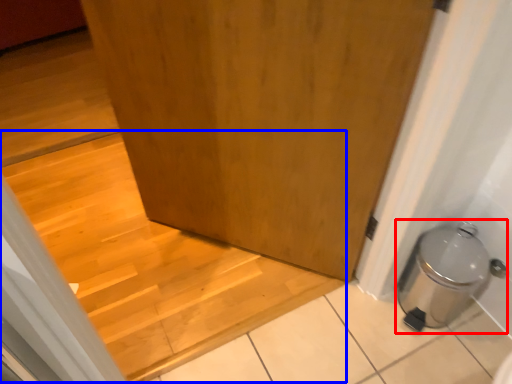
Question: Which point is closer to the camera, water heater (highlighted by a red box) or stairwell (highlighted by a blue box)?

Choices:
 (A) water heater
 (B) stairwell

Answer: (A)